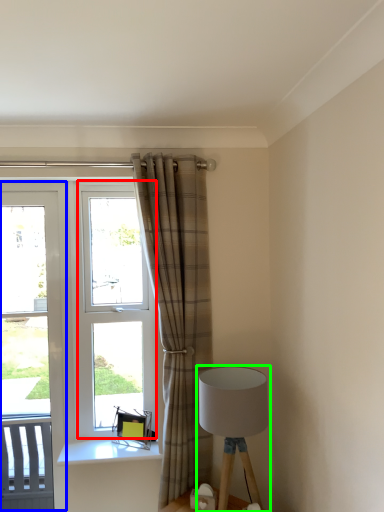
Question: Estimate the real-world distances between objects in this image. Which object is farther from window (highlighted by a red box), screen door (highlighted by a blue box) or lamp (highlighted by a green box)?

Choices:
 (A) screen door
 (B) lamp

Answer: (B)